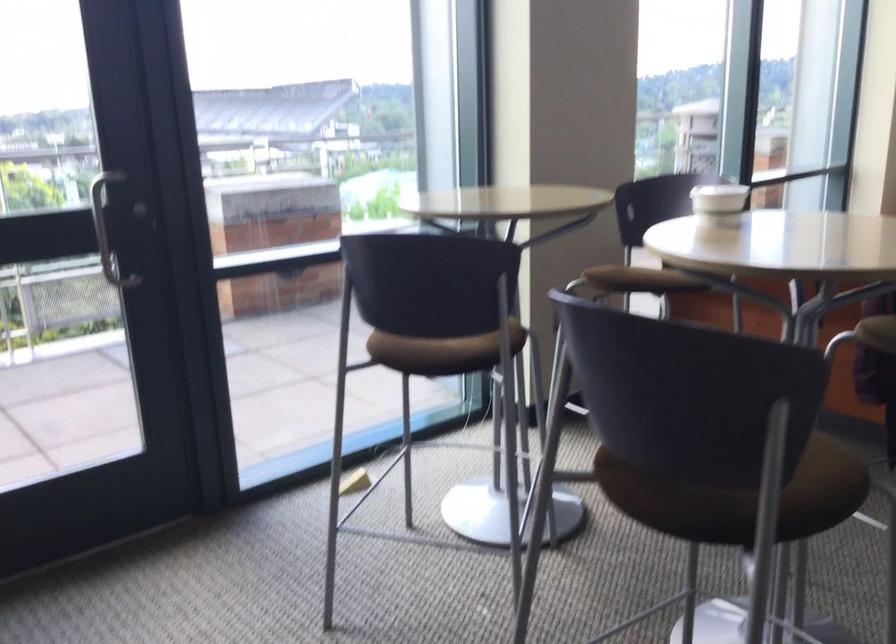
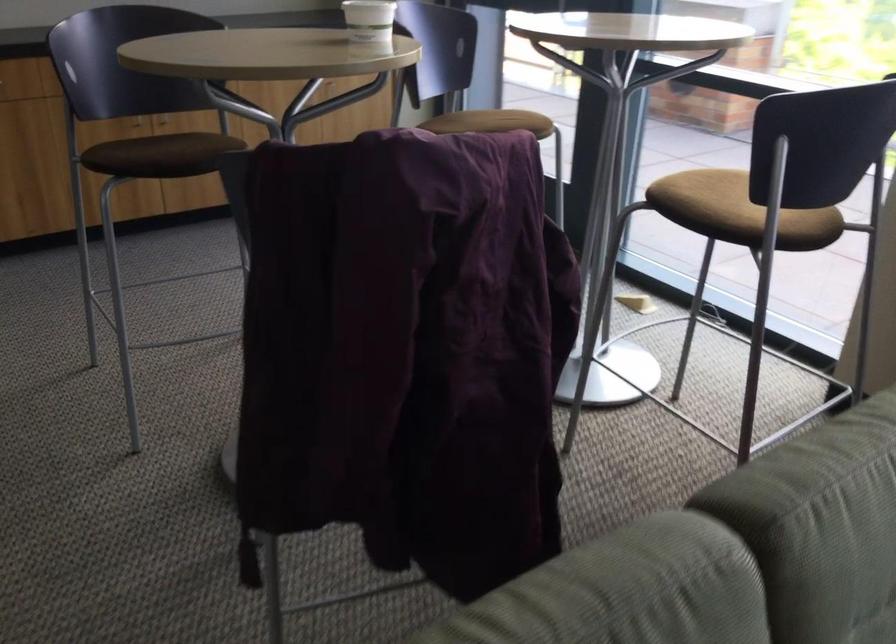
The point at (718, 200) is marked in the first image. Where is the corresponding point in the second image?

(368, 20)